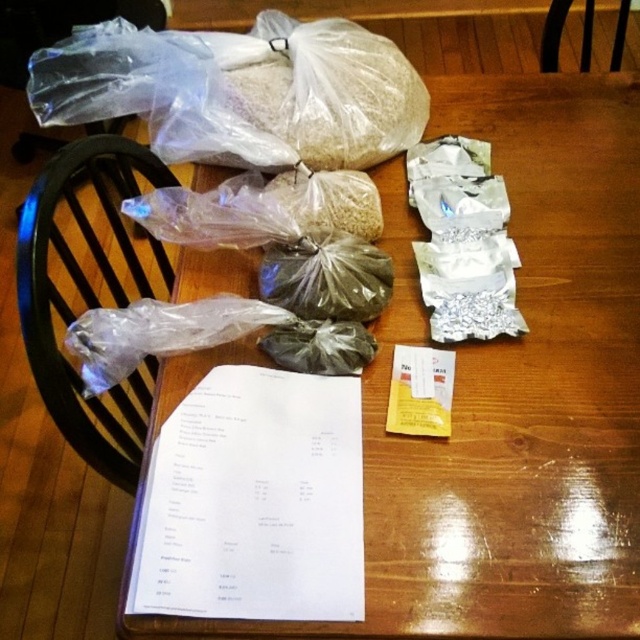
Does white paper at center have a lesser width compared to transparent plastic bag at lower left?

Yes, white paper at center is thinner than transparent plastic bag at lower left.

The height and width of the screenshot is (640, 640). What do you see at coordinates (253, 500) in the screenshot?
I see `white paper at center` at bounding box center [253, 500].

Is point (248, 369) positioned after point (112, 365)?

Yes, it is.

Identify the location of white paper at center. The width and height of the screenshot is (640, 640). (253, 500).

Image resolution: width=640 pixels, height=640 pixels. In order to click on clear plastic bag at upper center in this screenshot , I will do coord(240,92).

Measure the distance between clear plastic bag at upper center and black wood chair at left.

clear plastic bag at upper center and black wood chair at left are 24.28 centimeters apart from each other.

Locate an element on the screen. This screenshot has height=640, width=640. clear plastic bag at upper center is located at coordinates (240, 92).

The width and height of the screenshot is (640, 640). Find the location of `clear plastic bag at upper center`. clear plastic bag at upper center is located at coordinates (240, 92).

Who is more forward, (289, 317) or (614, 70)?

Point (289, 317) is in front.

This screenshot has height=640, width=640. In order to click on transparent plastic bag at lower left in this screenshot , I will do `click(160, 333)`.